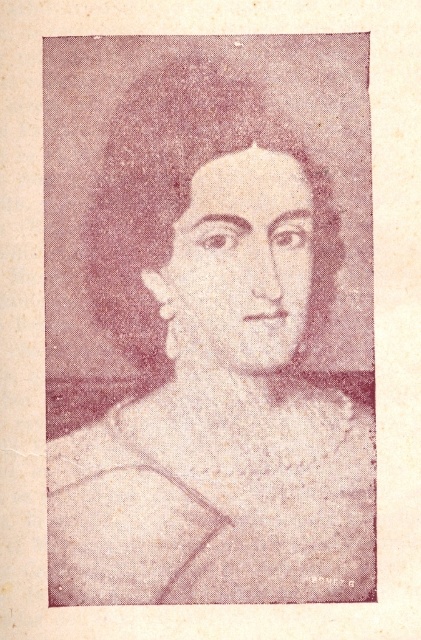
Question: Among these objects, which one is nearest to the camera?

Choices:
 (A) gray textured fabric at center
 (B) textured beige fabric at center

Answer: (B)

Question: Is gray textured fabric at center below textured beige fabric at center?

Choices:
 (A) no
 (B) yes

Answer: (A)

Question: Can you confirm if gray textured fabric at center is positioned to the left of textured beige fabric at center?

Choices:
 (A) yes
 (B) no

Answer: (A)

Question: Does gray textured fabric at center appear on the right side of textured beige fabric at center?

Choices:
 (A) yes
 (B) no

Answer: (B)

Question: Which point is closer to the camera taking this photo?

Choices:
 (A) (303, 412)
 (B) (143, 596)

Answer: (B)

Question: Which point is closer to the camera taking this photo?

Choices:
 (A) (293, 481)
 (B) (188, 518)

Answer: (B)